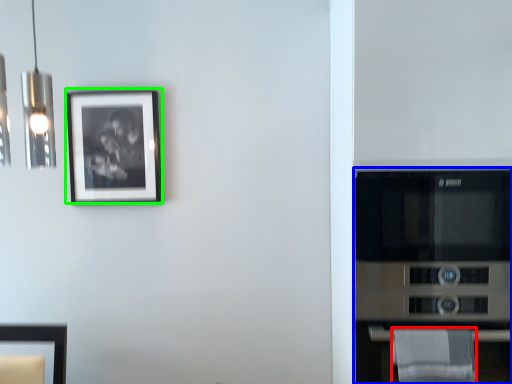
Question: Which is farther away from cloth (highlighted by a red box)? appliance (highlighted by a blue box) or picture frame (highlighted by a green box)?

Choices:
 (A) appliance
 (B) picture frame

Answer: (B)